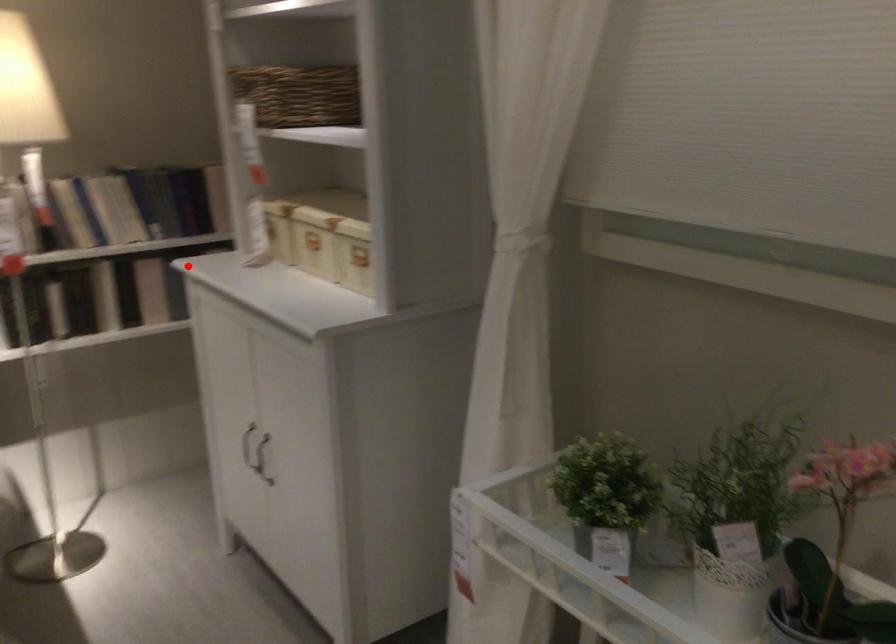
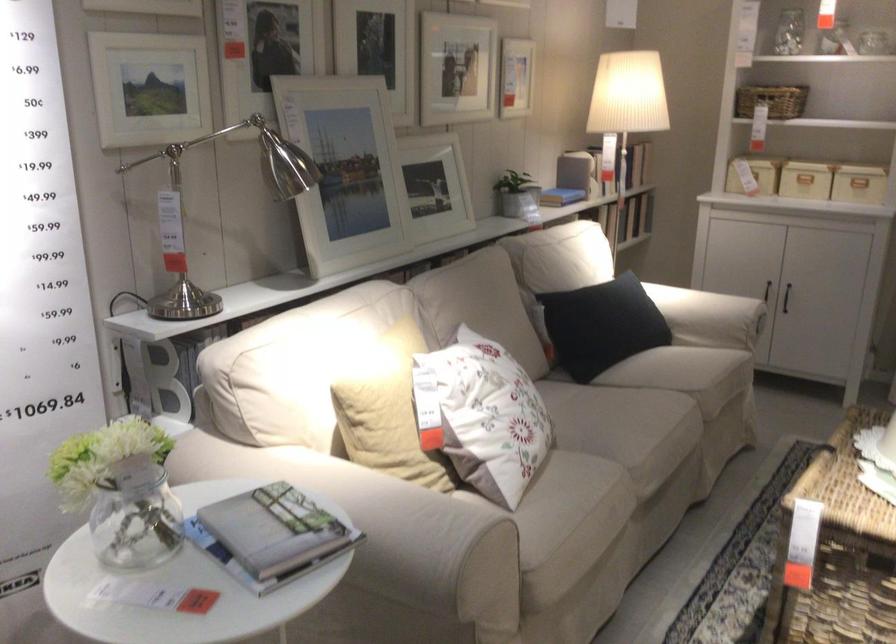
Question: I am providing you with two images of the same scene from different viewpoints. A red point is shown in image1. For the corresponding object point in image2, is it positioned nearer or farther from the camera?

Choices:
 (A) Nearer
 (B) Farther

Answer: (B)